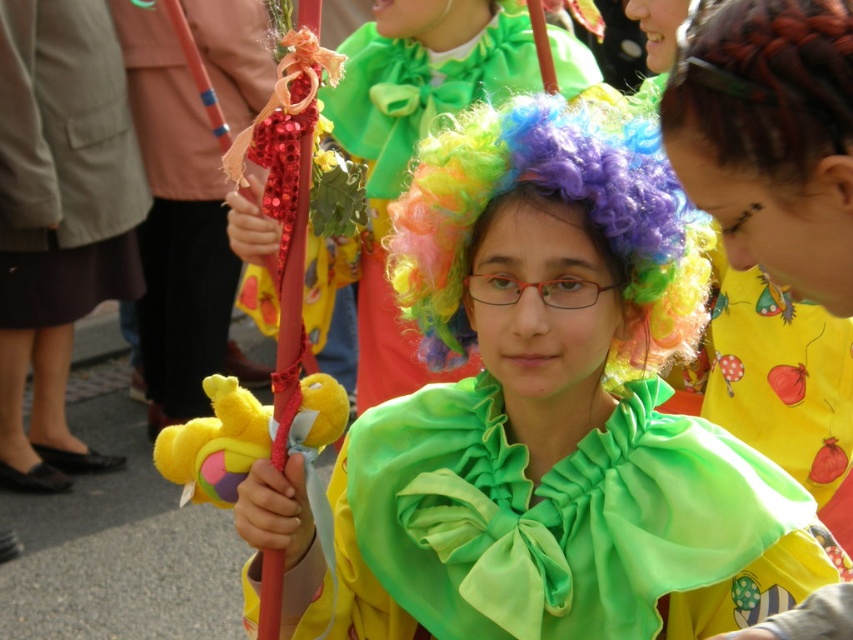
Question: Which is farther from the multicolored curly wig at center?

Choices:
 (A) shiny green fabric at center
 (B) soft plush toy at center

Answer: (A)

Question: Can you confirm if multicolored curly wig at center is bigger than soft plush toy at center?

Choices:
 (A) yes
 (B) no

Answer: (A)

Question: Is shiny green cape at center to the right of multicolored curly wig at upper right from the viewer's perspective?

Choices:
 (A) yes
 (B) no

Answer: (B)

Question: Which of the following is the farthest from the observer?

Choices:
 (A) soft plush toy at center
 (B) shiny green cape at center
 (C) multicolored curly wig at upper right
 (D) multicolored curly wig at center

Answer: (D)

Question: Does multicolored curly wig at center have a lesser width compared to multicolored curly wig at upper right?

Choices:
 (A) yes
 (B) no

Answer: (B)

Question: Among these points, which one is farthest from the camera?

Choices:
 (A) (155, 465)
 (B) (753, 147)

Answer: (A)